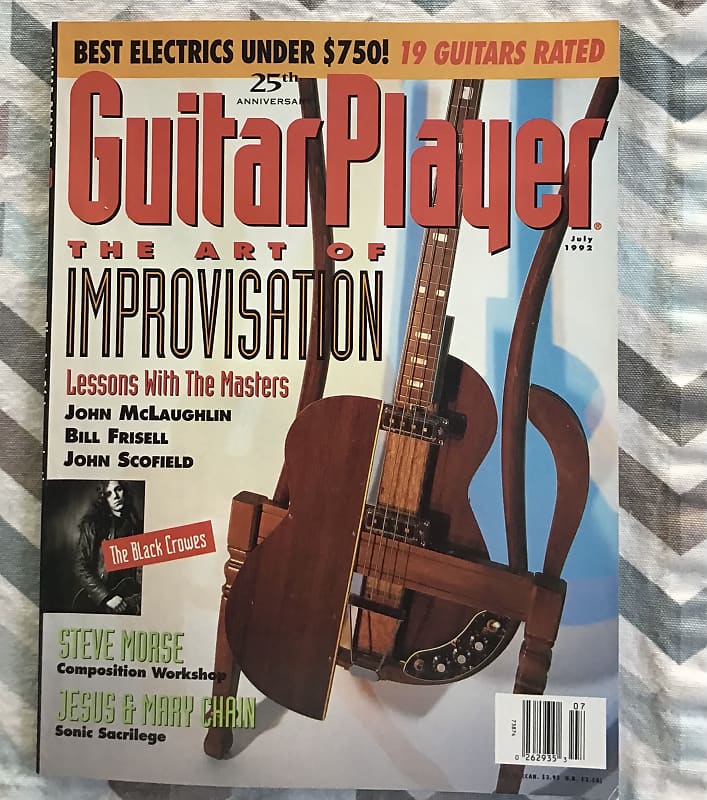
This screenshot has height=800, width=707. Find the location of `plug`. plug is located at coordinates (496, 626).